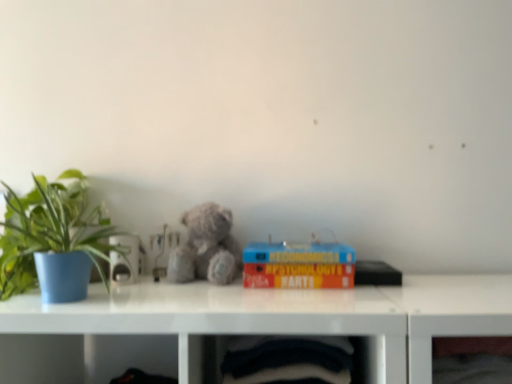
Locate an element on the screen. This screenshot has width=512, height=384. green matte plant at left is located at coordinates (53, 236).

What is the approximate width of green matte plant at left?

green matte plant at left is 32.13 centimeters wide.

I want to click on hardcover book at center, so click(298, 265).

This screenshot has height=384, width=512. What are the coordinates of `fuzzy gray teddy bear at center` in the screenshot? It's located at (206, 247).

At what (x,y) coordinates should I click in order to perform the action: click on transparent glass frame at lower right, which is the second shelf in left-to-right order. Please return your answer as a coordinate pair (x, y). This screenshot has height=384, width=512. Looking at the image, I should click on (444, 335).

Are transparent glass frame at lower right, which is the second shelf in left-to-right order, and velvet-like black fabric at lower center, which is the second shelf in right-to-left order, located far from each other?

transparent glass frame at lower right, which is the second shelf in left-to-right order, is near velvet-like black fabric at lower center, which is the second shelf in right-to-left order, not far away.

Locate an element on the screen. The height and width of the screenshot is (384, 512). shelf below the velvet-like black fabric at lower center, which is the second shelf in right-to-left order (from the image's perspective) is located at coordinates (444, 335).

What's the angular difference between transparent glass frame at lower right, which is the second shelf in left-to-right order, and velvet-like black fabric at lower center, which is the second shelf in right-to-left order,'s facing directions?

5.78e-05 degrees.

Looking at this image, considering the relative positions of transparent glass frame at lower right, the 1th shelf when ordered from right to left, and velvet-like black fabric at lower center, which is the second shelf in right-to-left order, in the image provided, is transparent glass frame at lower right, the 1th shelf when ordered from right to left, to the left of velvet-like black fabric at lower center, which is the second shelf in right-to-left order, from the viewer's perspective?

No, transparent glass frame at lower right, the 1th shelf when ordered from right to left, is not to the left of velvet-like black fabric at lower center, which is the second shelf in right-to-left order.

From the image's perspective, is green matte plant at left beneath transparent glass frame at lower right, which is the second shelf in left-to-right order?

No, from the image's perspective, green matte plant at left is not beneath transparent glass frame at lower right, which is the second shelf in left-to-right order.

You are a GUI agent. You are given a task and a screenshot of the screen. Output one action in this format:
    pyautogui.click(x=<x>, y=<y>)
    Task: Click on the 2nd shelf directly beneath the green matte plant at left (from a real-world perspective)
    
    Given the screenshot: What is the action you would take?
    pyautogui.click(x=444, y=335)

What's the angular difference between green matte plant at left and transparent glass frame at lower right, the 1th shelf when ordered from right to left,'s facing directions?

The angular difference between green matte plant at left and transparent glass frame at lower right, the 1th shelf when ordered from right to left, is 0.328 degrees.

Considering the relative sizes of green matte plant at left and transparent glass frame at lower right, the 1th shelf when ordered from right to left, in the image provided, is green matte plant at left smaller than transparent glass frame at lower right, the 1th shelf when ordered from right to left,?

No, green matte plant at left is not smaller than transparent glass frame at lower right, the 1th shelf when ordered from right to left.

Is velvet-like black fabric at lower center, which is the first shelf in left-to-right order, facing towards green matte plant at left?

No.

Does point (341, 366) appear closer or farther from the camera than point (8, 220)?

Point (341, 366) is closer to the camera than point (8, 220).

Locate an element on the screen. houseplant to the left of velvet-like black fabric at lower center, which is the first shelf in left-to-right order is located at coordinates (53, 236).

Which of these two, velvet-like black fabric at lower center, which is the first shelf in left-to-right order, or green matte plant at left, is wider?

green matte plant at left.

From a real-world perspective, is fuzzy gray teddy bear at center positioned above or below velvet-like black fabric at lower center, which is the second shelf in right-to-left order?

From a real-world perspective, fuzzy gray teddy bear at center is physically above velvet-like black fabric at lower center, which is the second shelf in right-to-left order.

This screenshot has height=384, width=512. I want to click on teddy bear on the left of velvet-like black fabric at lower center, which is the second shelf in right-to-left order, so [x=206, y=247].

From the image's perspective, who appears lower, fuzzy gray teddy bear at center or velvet-like black fabric at lower center, which is the first shelf in left-to-right order?

From the image's view, velvet-like black fabric at lower center, which is the first shelf in left-to-right order, is below.

Which is behind, fuzzy gray teddy bear at center or velvet-like black fabric at lower center, which is the first shelf in left-to-right order?

fuzzy gray teddy bear at center is behind.

Looking at this image, considering the relative sizes of transparent glass frame at lower right, which is the second shelf in left-to-right order, and fuzzy gray teddy bear at center in the image provided, is transparent glass frame at lower right, which is the second shelf in left-to-right order, wider than fuzzy gray teddy bear at center?

Yes.

Which is more to the left, transparent glass frame at lower right, which is the second shelf in left-to-right order, or fuzzy gray teddy bear at center?

fuzzy gray teddy bear at center is more to the left.

Is transparent glass frame at lower right, which is the second shelf in left-to-right order, situated inside fuzzy gray teddy bear at center or outside?

transparent glass frame at lower right, which is the second shelf in left-to-right order, exists outside the volume of fuzzy gray teddy bear at center.

Which is in front, transparent glass frame at lower right, the 1th shelf when ordered from right to left, or fuzzy gray teddy bear at center?

transparent glass frame at lower right, the 1th shelf when ordered from right to left, is in front.

From a real-world perspective, between velvet-like black fabric at lower center, which is the first shelf in left-to-right order, and hardcover book at center, who is vertically higher?

From a 3D spatial view, hardcover book at center is above.

Considering the relative positions of velvet-like black fabric at lower center, which is the second shelf in right-to-left order, and hardcover book at center in the image provided, is velvet-like black fabric at lower center, which is the second shelf in right-to-left order, in front of hardcover book at center?

Yes, velvet-like black fabric at lower center, which is the second shelf in right-to-left order, is closer to the viewer.

Consider the image. How much distance is there between velvet-like black fabric at lower center, which is the second shelf in right-to-left order, and transparent glass frame at lower right, the 1th shelf when ordered from right to left?

They are 8.86 inches apart.

Which point is more distant from viewer, (291,342) or (447,325)?

Point (291,342)

Is velvet-like black fabric at lower center, which is the first shelf in left-to-right order, smaller than transparent glass frame at lower right, the 1th shelf when ordered from right to left?

No, velvet-like black fabric at lower center, which is the first shelf in left-to-right order, is not smaller than transparent glass frame at lower right, the 1th shelf when ordered from right to left.

Between velvet-like black fabric at lower center, which is the first shelf in left-to-right order, and transparent glass frame at lower right, which is the second shelf in left-to-right order, which one appears on the left side from the viewer's perspective?

velvet-like black fabric at lower center, which is the first shelf in left-to-right order.

I want to click on shelf below the velvet-like black fabric at lower center, which is the first shelf in left-to-right order (from the image's perspective), so click(x=444, y=335).

Where is `the 1st shelf in front of the green matte plant at left, counting from the anchor's position`? Image resolution: width=512 pixels, height=384 pixels. the 1st shelf in front of the green matte plant at left, counting from the anchor's position is located at coordinates (444, 335).

Considering their positions, is hardcover book at center positioned further to velvet-like black fabric at lower center, which is the second shelf in right-to-left order, than green matte plant at left?

green matte plant at left is positioned further to the anchor velvet-like black fabric at lower center, which is the second shelf in right-to-left order.

Estimate the real-world distances between objects in this image. Which object is further from hardcover book at center, green matte plant at left or fuzzy gray teddy bear at center?

green matte plant at left is further to hardcover book at center.

Which object lies further to the anchor point transparent glass frame at lower right, which is the second shelf in left-to-right order, hardcover book at center or green matte plant at left?

green matte plant at left lies further to transparent glass frame at lower right, which is the second shelf in left-to-right order, than the other object.

Looking at the image, which one is located further to green matte plant at left, transparent glass frame at lower right, which is the second shelf in left-to-right order, or velvet-like black fabric at lower center, which is the second shelf in right-to-left order?

Among the two, transparent glass frame at lower right, which is the second shelf in left-to-right order, is located further to green matte plant at left.

Estimate the real-world distances between objects in this image. Which object is closer to green matte plant at left, velvet-like black fabric at lower center, which is the first shelf in left-to-right order, or hardcover book at center?

The object closer to green matte plant at left is hardcover book at center.

Estimate the real-world distances between objects in this image. Which object is further from green matte plant at left, hardcover book at center or transparent glass frame at lower right, which is the second shelf in left-to-right order?

The object further to green matte plant at left is transparent glass frame at lower right, which is the second shelf in left-to-right order.

From the image, which object appears to be nearer to fuzzy gray teddy bear at center, hardcover book at center or velvet-like black fabric at lower center, which is the first shelf in left-to-right order?

Based on the image, hardcover book at center appears to be nearer to fuzzy gray teddy bear at center.

In the scene shown: Looking at the image, which one is located closer to velvet-like black fabric at lower center, which is the first shelf in left-to-right order, transparent glass frame at lower right, the 1th shelf when ordered from right to left, or green matte plant at left?

transparent glass frame at lower right, the 1th shelf when ordered from right to left, is positioned closer to the anchor velvet-like black fabric at lower center, which is the first shelf in left-to-right order.

The height and width of the screenshot is (384, 512). I want to click on teddy bear between green matte plant at left and hardcover book at center, so click(206, 247).

You are a GUI agent. You are given a task and a screenshot of the screen. Output one action in this format:
    pyautogui.click(x=<x>, y=<y>)
    Task: Click on the shelf located between green matte plant at left and transparent glass frame at lower right, which is the second shelf in left-to-right order, in the left-right direction
    The image size is (512, 384).
    Given the screenshot: What is the action you would take?
    pyautogui.click(x=287, y=360)

You are a GUI agent. You are given a task and a screenshot of the screen. Output one action in this format:
    pyautogui.click(x=<x>, y=<y>)
    Task: Click on the toy between fuzzy gray teddy bear at center and transparent glass frame at lower right, which is the second shelf in left-to-right order, from left to right
    The height and width of the screenshot is (384, 512).
    Given the screenshot: What is the action you would take?
    pyautogui.click(x=298, y=265)

The width and height of the screenshot is (512, 384). Identify the location of shelf located between fuzzy gray teddy bear at center and transparent glass frame at lower right, the 1th shelf when ordered from right to left, in the left-right direction. (287, 360).